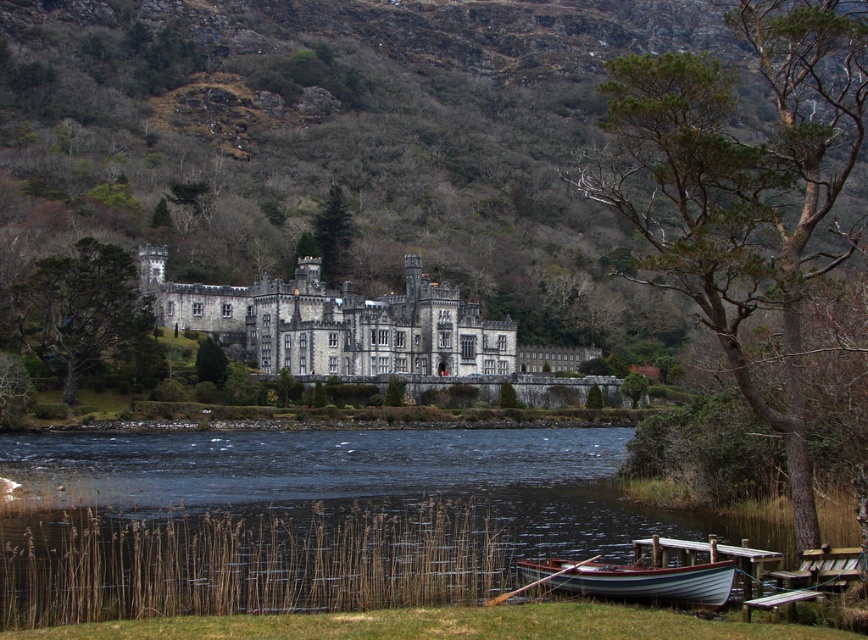
You are a drone operator tasked with capturing aerial footage of the historic stone castle. Your drone is currently hovering at point 0.5, 0.5 in the scene. You need to adjust your position to avoid the green rough bark tree at center right. Which direction should you move the drone to avoid it?

The green rough bark tree at center right is located at point (742,188). Since the drone is at (434,320), which is to the right and above the tree, moving the drone further to the right and upwards would increase the distance from the tree. Alternatively, moving left and downward would bring it closer. To avoid the tree, moving the drone to the right and upward would be the best direction.

You are standing in front of the castle and notice two trees in the scene. Which tree, the green rough bark tree at center right or the green textured tree at left, is positioned higher up relative to the castle?

The green rough bark tree at center right is positioned higher up relative to the castle than the green textured tree at left because it is located above it.

You are an architect planning to build a new garden path that leads from the green textured tree at left to the green matte tree at upper center. Considering their sizes, which tree will the path start closer to the base of?

The path should start closer to the base of the green textured tree at left because it is larger in size than the green matte tree at upper center.